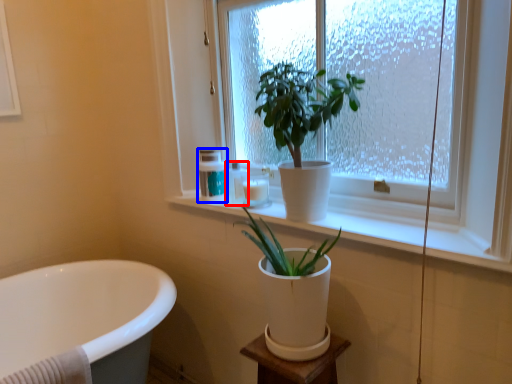
Question: Which object appears farthest to the camera in this image, toiletry (highlighted by a red box) or toiletry (highlighted by a blue box)?

Choices:
 (A) toiletry
 (B) toiletry

Answer: (B)